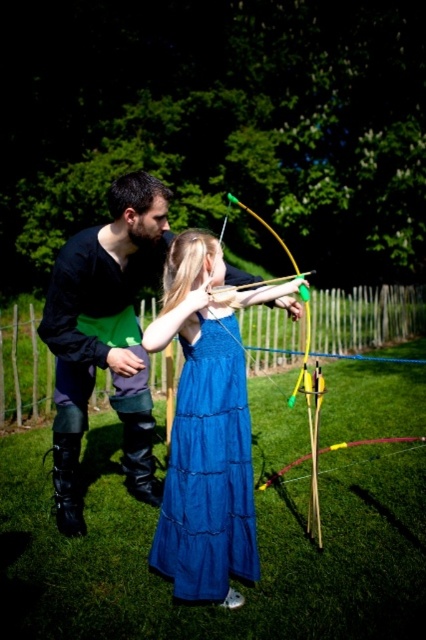
You are an archer standing at the center of the grassy area. You need to place your new black leather boots at left exactly where the existing ones are located. According to the coordinates provided, what are the coordinates where you should place your new boots?

The coordinates for placing the new black leather boots at left should be exactly at point (104,337) to match the existing boots.

From the picture: A child is trying to shoot an arrow from the yellow wood bow at center. The child is wearing a blue cotton dress at center. The child needs to step back so that they are at least 2 meters away from the bow to ensure safety. Is the child currently within the safe distance?

The distance between the blue cotton dress at center and the yellow wood bow at center is 1.52 meters. Since 1.52 meters is less than 2 meters, the child is not at a safe distance and needs to move back further.

You are an archer preparing to shoot an arrow. You notice two items in your viewfinder while aiming at the target. The black leather boots at left and the blue cotton dress at center. Which item is closer to you?

The black leather boots at left is closer to you since it is only 26.50 inches away from the blue cotton dress at center, which is further away.